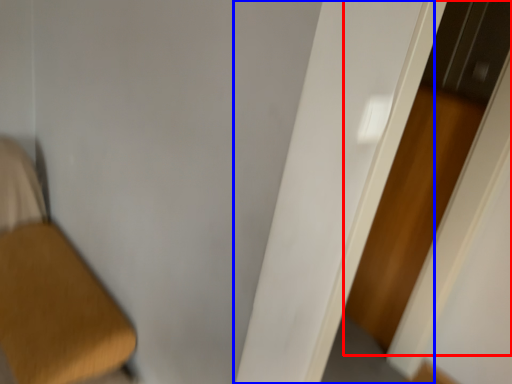
Question: Which object appears farthest to the camera in this image, screen door (highlighted by a red box) or door (highlighted by a blue box)?

Choices:
 (A) screen door
 (B) door

Answer: (A)